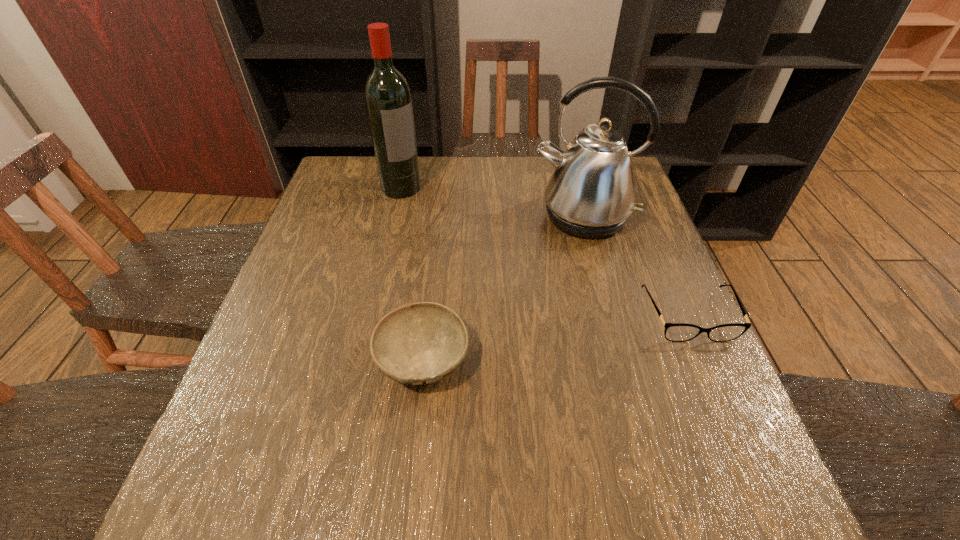
Find the location of a particular element. Image resolution: width=960 pixels, height=540 pixels. vacant space located 0.090m from the spout of the kettle is located at coordinates (569, 267).

The width and height of the screenshot is (960, 540). Find the location of `vacant area situated from the spout of the kettle`. vacant area situated from the spout of the kettle is located at coordinates (563, 296).

The height and width of the screenshot is (540, 960). Identify the location of wine bottle that is positioned at the far edge. (388, 100).

Find the location of a particular element. Image resolution: width=960 pixels, height=540 pixels. kettle that is at the far edge is located at coordinates (591, 194).

In order to click on object that is at the near edge in this screenshot , I will do click(x=420, y=343).

Locate an element on the screen. object that is at the left edge is located at coordinates (388, 100).

The height and width of the screenshot is (540, 960). I want to click on spectacles situated at the right edge, so click(676, 332).

The image size is (960, 540). What are the coordinates of `kettle that is at the right edge` in the screenshot? It's located at (591, 194).

Identify the location of object present at the far left corner. Image resolution: width=960 pixels, height=540 pixels. (388, 100).

The height and width of the screenshot is (540, 960). Find the location of `object positioned at the far right corner`. object positioned at the far right corner is located at coordinates (591, 194).